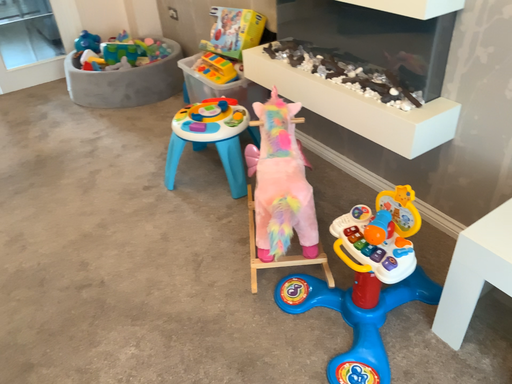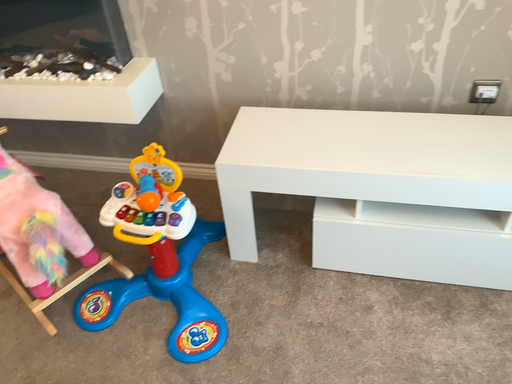
Question: Which way did the camera rotate in the video?

Choices:
 (A) rotated left
 (B) rotated right

Answer: (B)